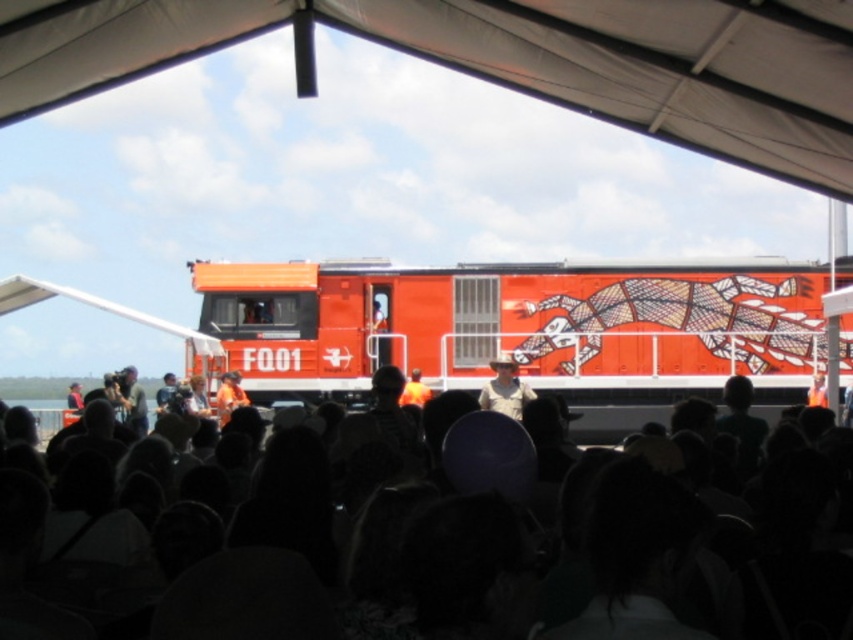
Question: Which point is farther to the camera?

Choices:
 (A) orange matte train at center
 (B) matte black shirt at center
 (C) white fabric tent at upper center
 (D) matte black camera at center

Answer: (B)

Question: Estimate the real-world distances between objects in this image. Which object is closer to the white fabric tent at upper center?

Choices:
 (A) matte black shirt at center
 (B) orange fabric at center
 (C) matte black camera at center
 (D) orange matte train at center

Answer: (D)

Question: Is khaki fabric hat at center thinner than orange fabric at center?

Choices:
 (A) yes
 (B) no

Answer: (B)

Question: Can you confirm if white fabric canopy at upper center is bigger than orange matte train at center?

Choices:
 (A) yes
 (B) no

Answer: (A)

Question: Does white fabric tent at upper center appear under orange fabric shirt at center?

Choices:
 (A) yes
 (B) no

Answer: (B)

Question: Among these points, which one is farthest from the camera?

Choices:
 (A) (125, 419)
 (B) (398, 342)

Answer: (A)